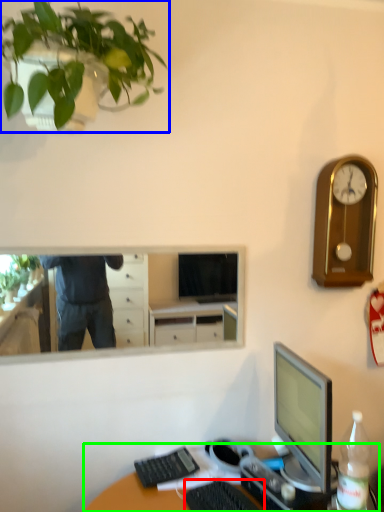
Question: Estimate the real-world distances between objects in this image. Which object is closer to computer keyboard (highlighted by a red box), houseplant (highlighted by a blue box) or desk (highlighted by a green box)?

Choices:
 (A) houseplant
 (B) desk

Answer: (B)